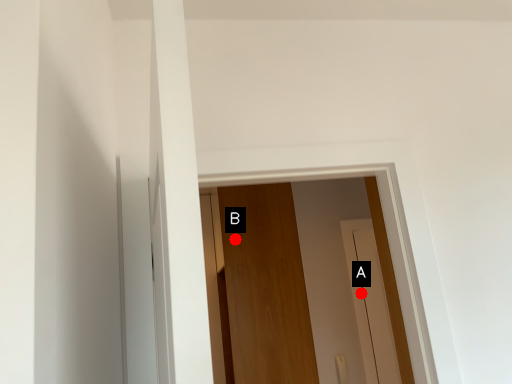
Question: Two points are circled on the image, labeled by A and B beside each circle. Among these points, which one is nearest to the camera?

Choices:
 (A) A is closer
 (B) B is closer

Answer: (B)